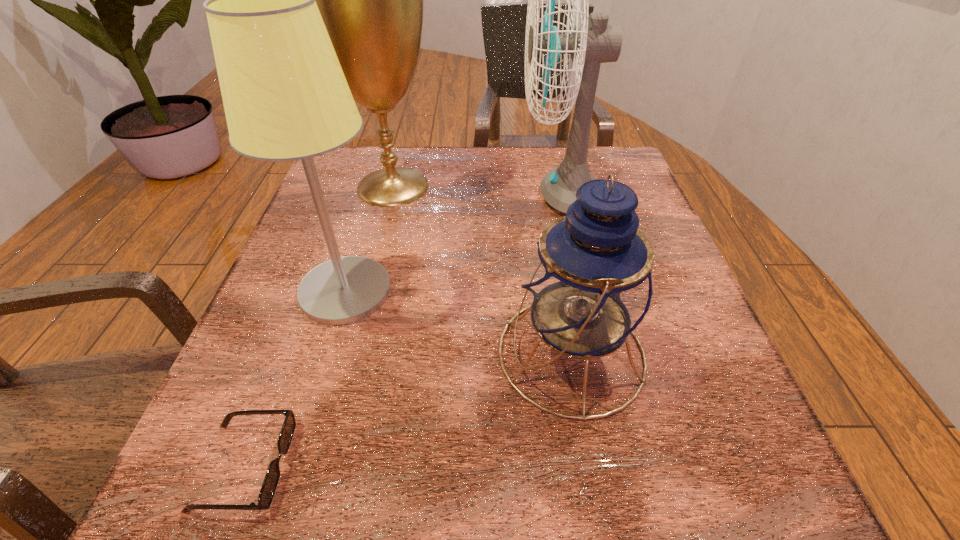
The image size is (960, 540). In order to click on fan that is positioned at the right edge in this screenshot , I will do `click(590, 43)`.

This screenshot has width=960, height=540. I want to click on lantern that is at the right edge, so click(x=588, y=285).

Identify the location of object that is at the far left corner. This screenshot has width=960, height=540. (371, 0).

In order to click on object at the near left corner in this screenshot , I will do `click(272, 476)`.

The height and width of the screenshot is (540, 960). I want to click on object that is at the far right corner, so click(x=590, y=43).

The height and width of the screenshot is (540, 960). I want to click on blank space at the far edge of the desktop, so click(543, 157).

In the image, there is a desktop. Where is `free space at the near edge`? Image resolution: width=960 pixels, height=540 pixels. free space at the near edge is located at coordinates (638, 487).

In the image, there is a desktop. Where is `vacant space at the left edge`? The height and width of the screenshot is (540, 960). vacant space at the left edge is located at coordinates pos(239,366).

You are a GUI agent. You are given a task and a screenshot of the screen. Output one action in this format:
    pyautogui.click(x=<x>, y=<y>)
    Task: Click on the vacant space at the right edge
    This screenshot has width=960, height=540.
    Given the screenshot: What is the action you would take?
    pyautogui.click(x=709, y=346)

Find the location of a particular element. The image size is (960, 540). free location at the far left corner is located at coordinates (340, 157).